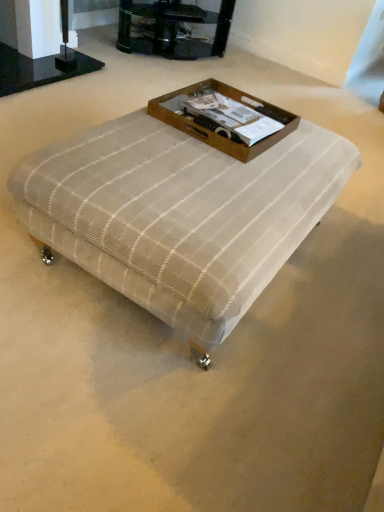
This screenshot has width=384, height=512. Identify the location of empty space that is ontop of plaid fabric ottoman at center (from a real-world perspective). (213, 164).